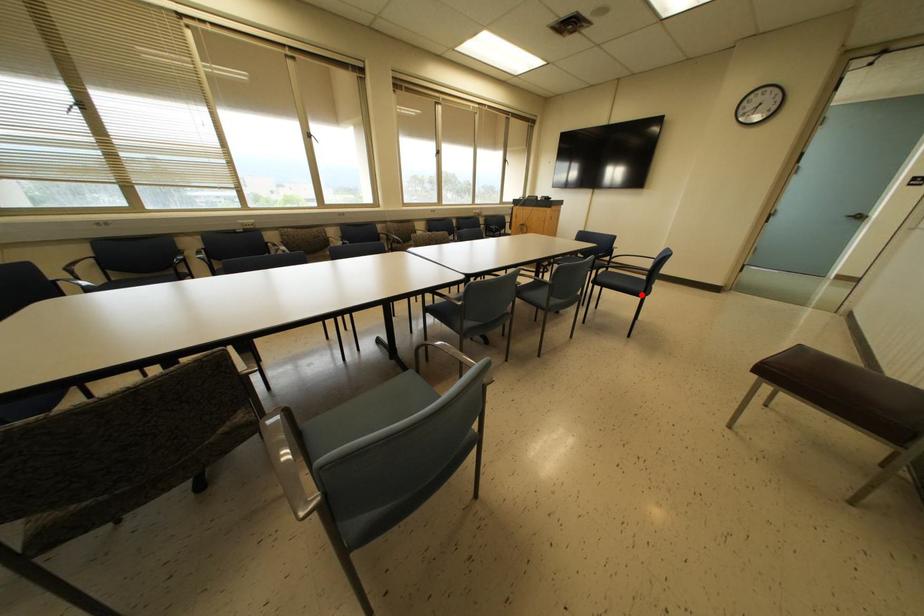
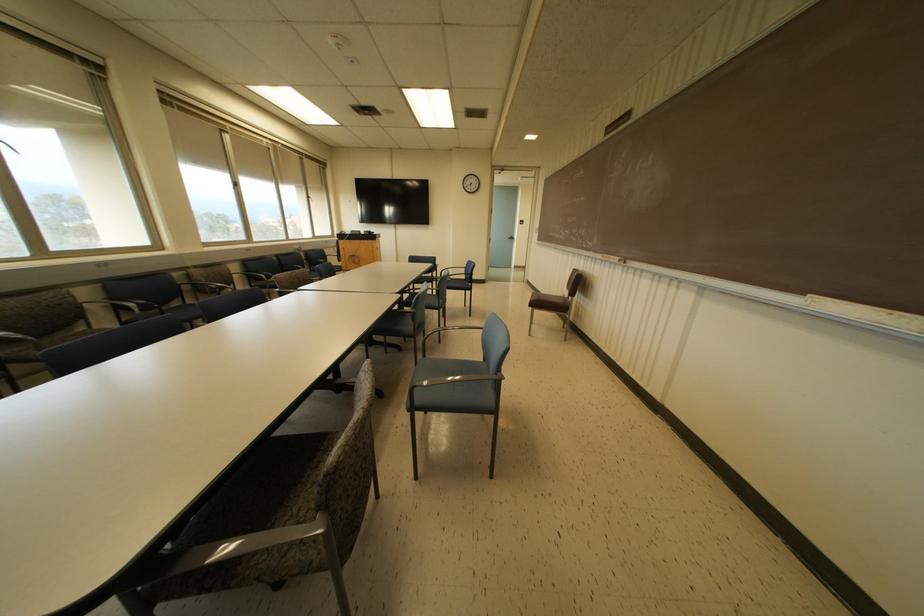
Question: A red point is marked in image1. In image2, is the corresponding 3D point closer to the camera or farther? Reply with the corresponding letter.

Choices:
 (A) The corresponding 3D point is closer.
 (B) The corresponding 3D point is farther.

Answer: (B)